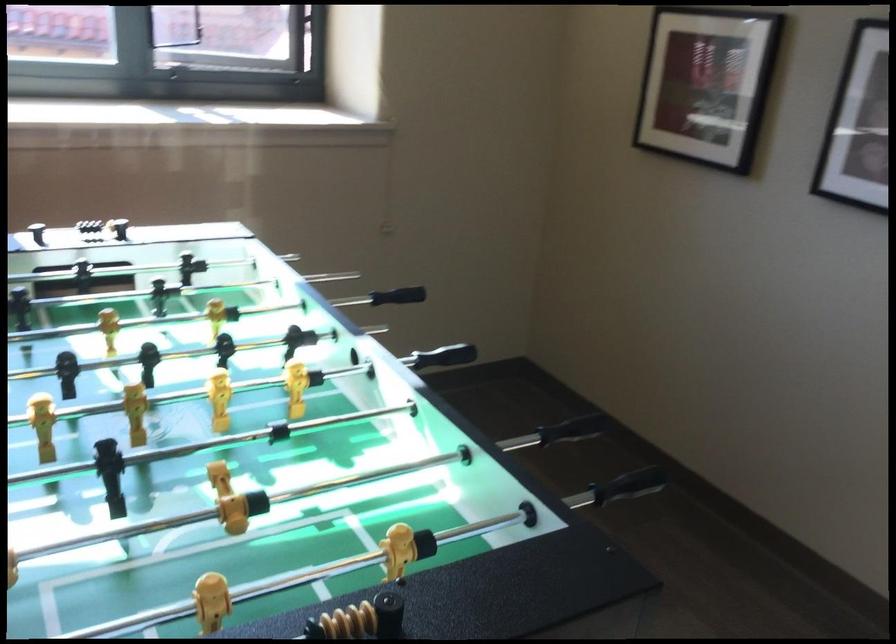
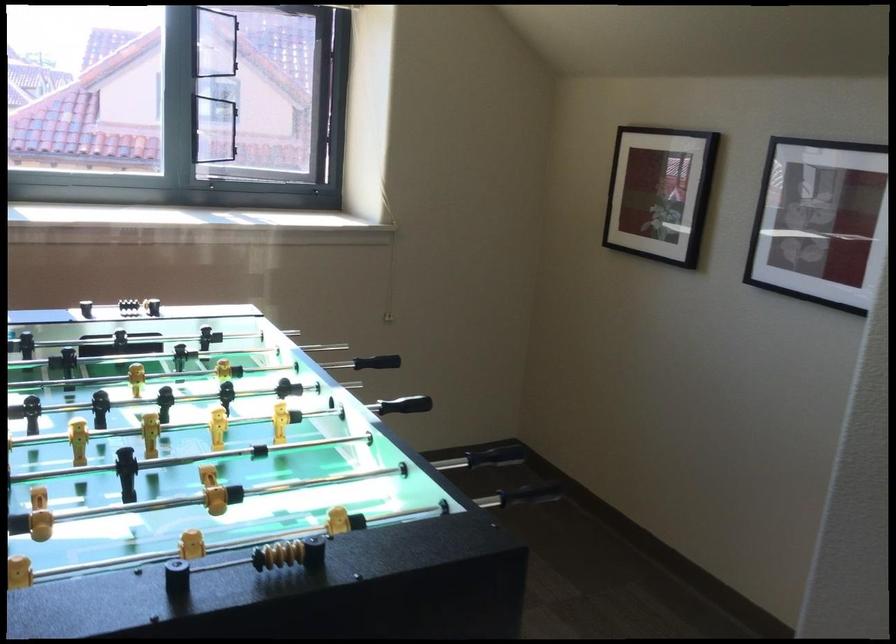
Locate, in the second image, the point that corresponds to point 709,86 in the first image.

(659, 193)